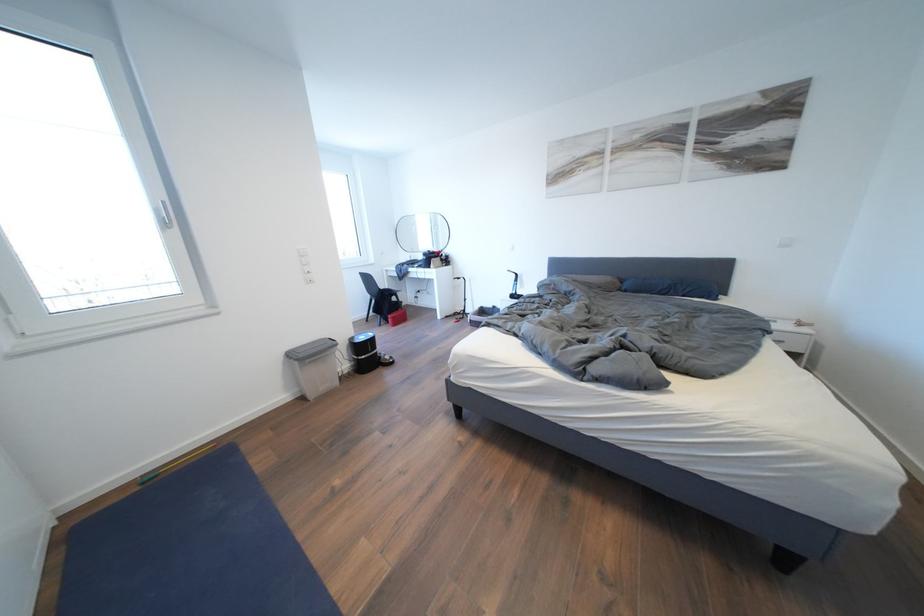
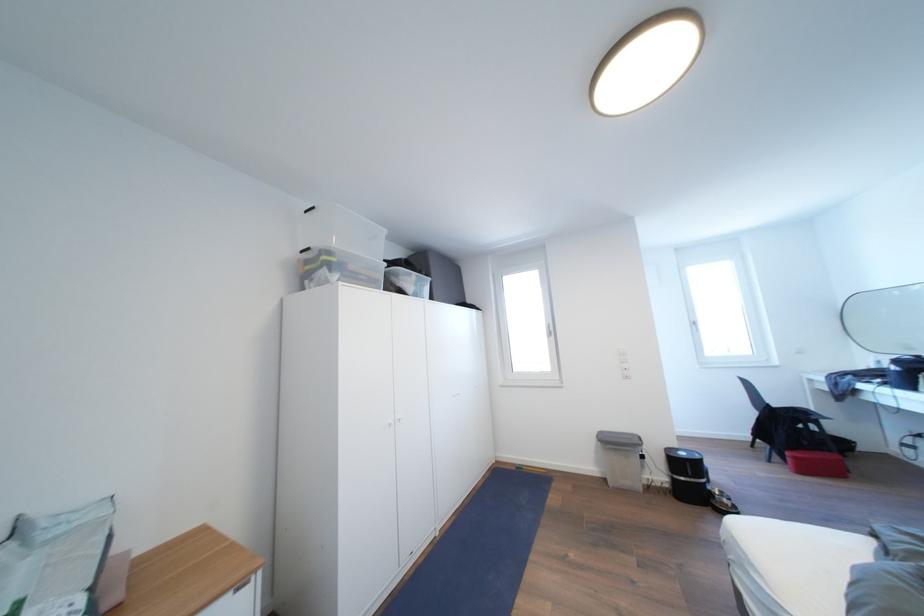
In the second image, find the point that corresponds to point (400, 323) in the first image.

(803, 463)